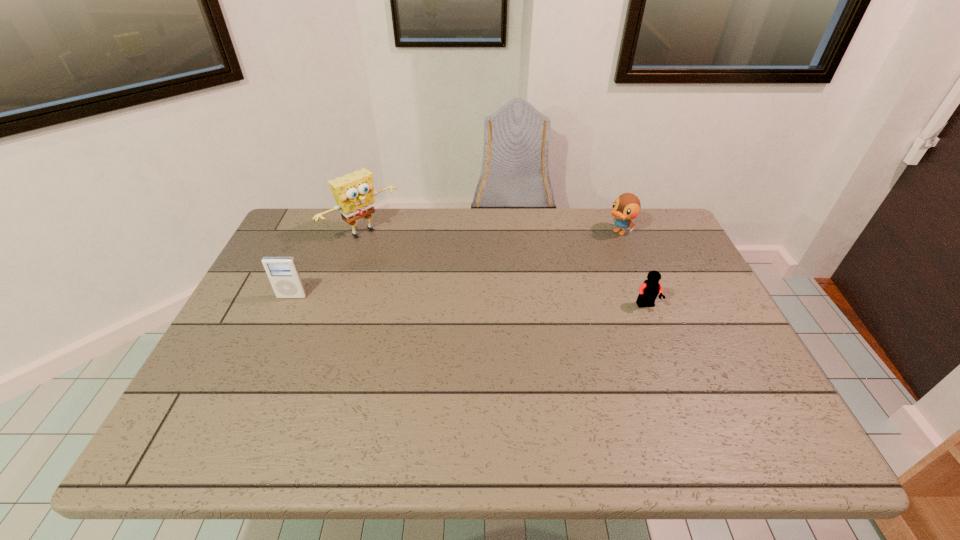
This screenshot has height=540, width=960. In order to click on object present at the far right corner in this screenshot , I will do (x=626, y=207).

Identify the location of vacant space at the far edge of the desktop. (523, 238).

This screenshot has width=960, height=540. Identify the location of free spot at the near edge of the desktop. (276, 383).

What are the coordinates of `free space at the right edge of the desktop` in the screenshot? It's located at (723, 365).

What are the coordinates of `vacant region at the far left corner of the desktop` in the screenshot? It's located at (294, 245).

Find the location of a particular element. This screenshot has width=960, height=540. blank space at the near left corner of the desktop is located at coordinates (250, 411).

This screenshot has height=540, width=960. What are the coordinates of `vacant point at the far right corner` in the screenshot? It's located at (656, 228).

In order to click on free spot between the duck and the second nearest object in this screenshot , I will do `click(455, 265)`.

Identify the location of vacant space that's between the nearest object and the tallest object. (505, 269).

You are a GUI agent. You are given a task and a screenshot of the screen. Output one action in this format:
    pyautogui.click(x=<x>, y=<y>)
    Task: Click on the free spot between the duck and the shortest object
    This screenshot has width=960, height=540.
    Given the screenshot: What is the action you would take?
    pyautogui.click(x=633, y=269)